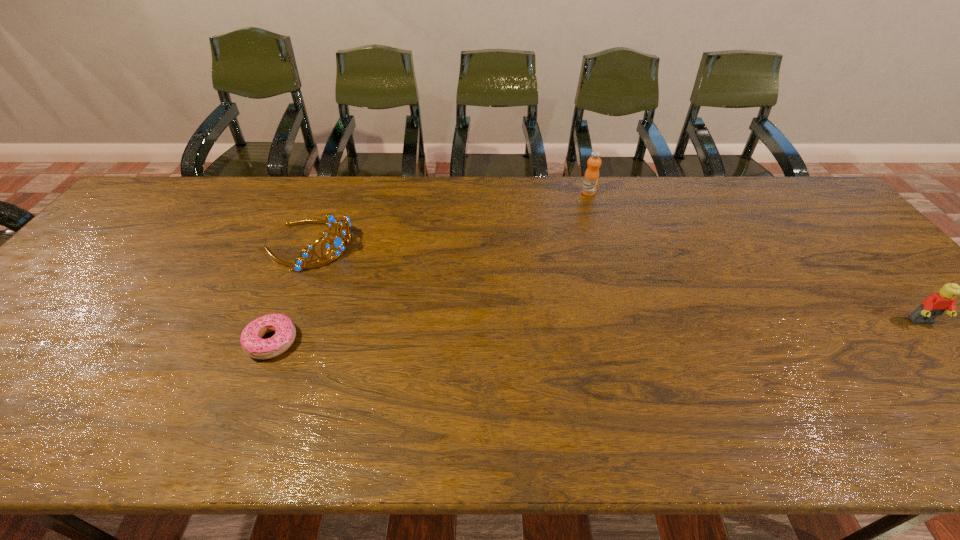
You are a GUI agent. You are given a task and a screenshot of the screen. Output one action in this format:
    pyautogui.click(x=<x>, y=<y>)
    Task: Click on the unoccupied area between the doughnut and the second object from right to left
    
    Given the screenshot: What is the action you would take?
    pyautogui.click(x=430, y=267)

At what (x,y) coordinates should I click in order to perform the action: click on free area in between the second object from right to left and the doughnut. Please return your answer as a coordinate pair (x, y). The width and height of the screenshot is (960, 540). Looking at the image, I should click on (430, 267).

You are a GUI agent. You are given a task and a screenshot of the screen. Output one action in this format:
    pyautogui.click(x=<x>, y=<y>)
    Task: Click on the object that ranks as the second closest to the shortest object
    The height and width of the screenshot is (540, 960).
    Given the screenshot: What is the action you would take?
    pyautogui.click(x=591, y=177)

Select which object appears as the closest to the rightmost object. Please provide its 2D coordinates. Your answer should be formatted as a tuple, i.e. [(x, y)], where the tuple contains the x and y coordinates of a point satisfying the conditions above.

[(591, 177)]